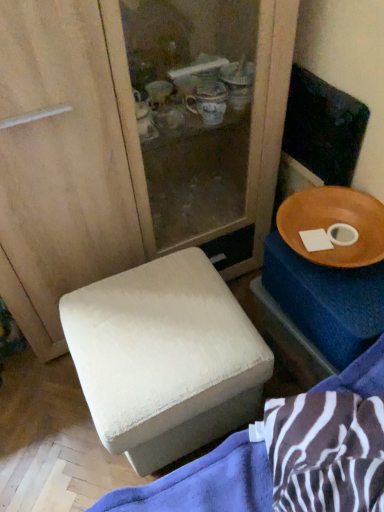
Question: Can you confirm if white fabric ottoman at lower left is thinner than wooden bowl at right?

Choices:
 (A) yes
 (B) no

Answer: (B)

Question: From a real-world perspective, is white fabric ottoman at lower left positioned under wooden bowl at right based on gravity?

Choices:
 (A) yes
 (B) no

Answer: (A)

Question: Is white fabric ottoman at lower left touching wooden bowl at right?

Choices:
 (A) no
 (B) yes

Answer: (A)

Question: From the image's perspective, is white fabric ottoman at lower left on wooden bowl at right?

Choices:
 (A) no
 (B) yes

Answer: (A)

Question: Is white fabric ottoman at lower left not within wooden bowl at right?

Choices:
 (A) no
 (B) yes

Answer: (B)

Question: Is white fabric ottoman at lower left inside the boundaries of wooden bowl at right, or outside?

Choices:
 (A) inside
 (B) outside

Answer: (B)

Question: From the image's perspective, is white fabric ottoman at lower left located above or below wooden bowl at right?

Choices:
 (A) below
 (B) above

Answer: (A)

Question: In terms of height, does white fabric ottoman at lower left look taller or shorter compared to wooden bowl at right?

Choices:
 (A) tall
 (B) short

Answer: (A)

Question: Considering their positions, is white fabric ottoman at lower left located in front of or behind wooden bowl at right?

Choices:
 (A) front
 (B) behind

Answer: (A)

Question: Is point (382, 306) closer or farther from the camera than point (304, 218)?

Choices:
 (A) farther
 (B) closer

Answer: (B)

Question: From the image's perspective, is wooden tray at right located above or below wooden bowl at right?

Choices:
 (A) above
 (B) below

Answer: (B)

Question: Is wooden tray at right wider or thinner than wooden bowl at right?

Choices:
 (A) wide
 (B) thin

Answer: (B)

Question: Is wooden tray at right inside the boundaries of wooden bowl at right, or outside?

Choices:
 (A) outside
 (B) inside

Answer: (A)

Question: Is white fabric ottoman at lower left inside the boundaries of wooden tray at right, or outside?

Choices:
 (A) inside
 (B) outside

Answer: (B)

Question: Based on their positions, is white fabric ottoman at lower left located to the left or right of wooden tray at right?

Choices:
 (A) right
 (B) left

Answer: (B)